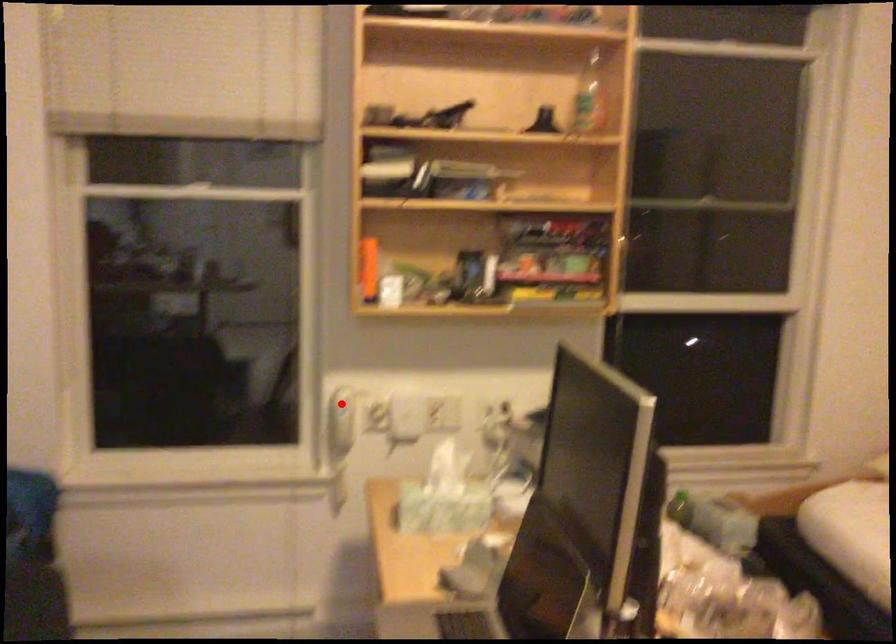
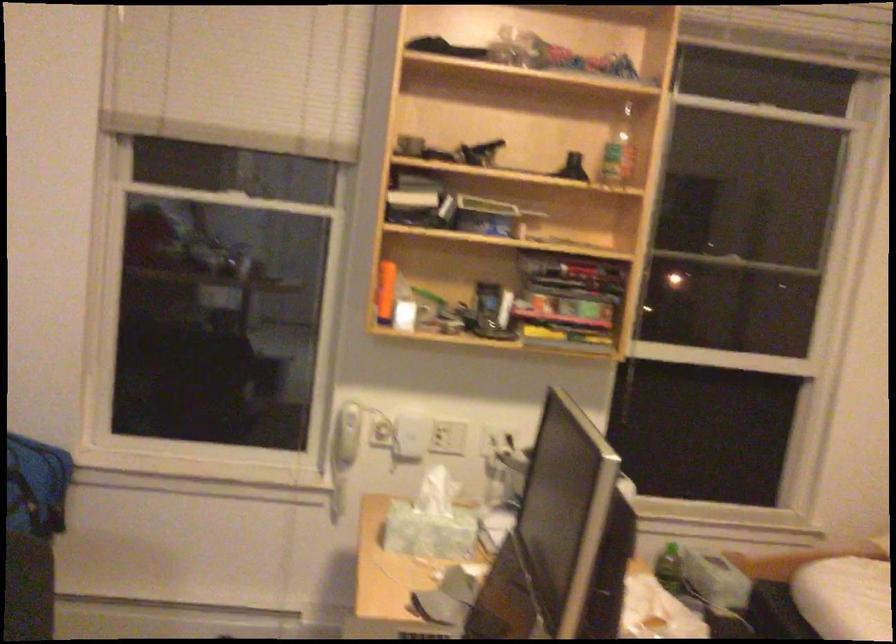
In the second image, find the point that corresponds to the highlighted location in the first image.

(349, 418)